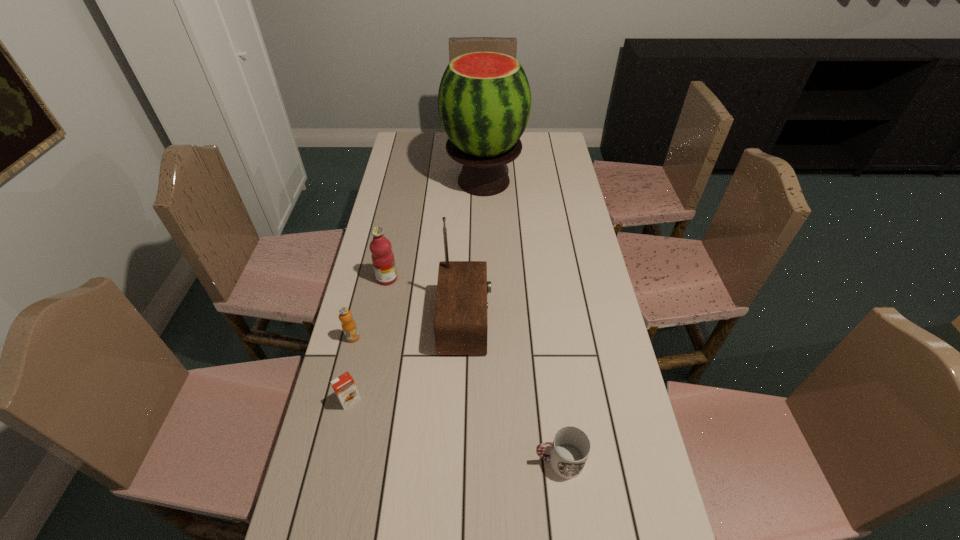
Find the location of a particular element. This screenshot has height=540, width=960. vacant space that satisfies the following two spatial constraints: 1. on the front label of the nearer orange juice; 2. on the right side of the taller orange juice is located at coordinates (337, 400).

Image resolution: width=960 pixels, height=540 pixels. I want to click on blank area in the image that satisfies the following two spatial constraints: 1. on the handle side of the cup; 2. on the front label of the taller orange juice, so click(x=543, y=338).

This screenshot has height=540, width=960. In order to click on free region that satisfies the following two spatial constraints: 1. on the label of the third tallest object; 2. on the handle side of the nearest object in this screenshot , I will do `click(350, 461)`.

You are a GUI agent. You are given a task and a screenshot of the screen. Output one action in this format:
    pyautogui.click(x=<x>, y=<y>)
    Task: Click on the vacant area in the image that satisfies the following two spatial constraints: 1. on the front side of the tallest object; 2. on the front-facing side of the second tallest object
    
    Given the screenshot: What is the action you would take?
    pyautogui.click(x=486, y=322)

You are a GUI agent. You are given a task and a screenshot of the screen. Output one action in this format:
    pyautogui.click(x=<x>, y=<y>)
    Task: Click on the vacant space that satisfies the following two spatial constraints: 1. on the label of the fourth shortest object; 2. on the handle side of the nearest object
    The height and width of the screenshot is (540, 960).
    Given the screenshot: What is the action you would take?
    pyautogui.click(x=350, y=461)